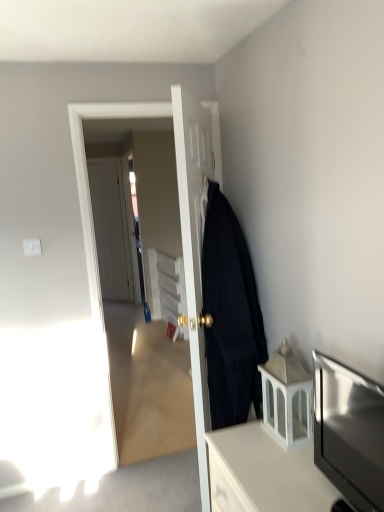
What is the approximate width of transparent glass door at center?

transparent glass door at center is 4.83 inches in width.

How much space does white glass lantern at lower right, the 1th cabinetry when ordered from top to bottom, occupy horizontally?

The width of white glass lantern at lower right, the 1th cabinetry when ordered from top to bottom, is 6.90 inches.

Describe the element at coordinates (287, 398) in the screenshot. I see `white glass lantern at lower right, the 1th cabinetry when ordered from top to bottom` at that location.

Find the location of a particular element. This screenshot has width=384, height=512. matte black tv at lower right is located at coordinates (349, 431).

Considering the sizes of objects white glossy cabinet at lower right, marked as the second cabinetry in a top-to-bottom arrangement, and matte black tv at lower right in the image provided, who is bigger, white glossy cabinet at lower right, marked as the second cabinetry in a top-to-bottom arrangement, or matte black tv at lower right?

white glossy cabinet at lower right, marked as the second cabinetry in a top-to-bottom arrangement.

From a real-world perspective, which is physically above, white glossy cabinet at lower right, which is the first cabinetry in bottom-to-top order, or matte black tv at lower right?

In real-world perspective, matte black tv at lower right is above.

Is white glossy cabinet at lower right, marked as the second cabinetry in a top-to-bottom arrangement, spatially inside matte black tv at lower right, or outside of it?

white glossy cabinet at lower right, marked as the second cabinetry in a top-to-bottom arrangement, is not inside matte black tv at lower right, it's outside.

Is white glass lantern at lower right, the 1th cabinetry when ordered from top to bottom, surrounding black woolen coat at right?

Actually, black woolen coat at right is outside white glass lantern at lower right, the 1th cabinetry when ordered from top to bottom.

From the image's perspective, starting from the black woolen coat at right, which cabinetry is the 1st one below? Please provide its 2D coordinates.

[(287, 398)]

Are white glass lantern at lower right, which is the second cabinetry from bottom to top, and black woolen coat at right far apart?

white glass lantern at lower right, which is the second cabinetry from bottom to top, is near black woolen coat at right, not far away.

Which is closer to the camera, (293,439) or (222,381)?

Point (293,439).

Between black woolen coat at right and white matte door at center, which is counted as the first door, starting from the left, which one has smaller width?

Thinner between the two is white matte door at center, which is counted as the first door, starting from the left.

Which object is further away from the camera, black woolen coat at right or white matte door at center, positioned as the first door in back-to-front order?

white matte door at center, positioned as the first door in back-to-front order, is more distant.

From the image's perspective, is black woolen coat at right beneath white matte door at center, the 2th door positioned from the right?

Correct, black woolen coat at right appears lower than white matte door at center, the 2th door positioned from the right, in the image.

From the image's perspective, which is above, matte black tv at lower right or white glass lantern at lower right, which is the second cabinetry from bottom to top?

white glass lantern at lower right, which is the second cabinetry from bottom to top, is shown above in the image.

Looking at their sizes, would you say matte black tv at lower right is wider or thinner than white glass lantern at lower right, which is the second cabinetry from bottom to top?

matte black tv at lower right is wider than white glass lantern at lower right, which is the second cabinetry from bottom to top.

This screenshot has height=512, width=384. Identify the location of cabinetry that is the 2nd one when counting backward from the matte black tv at lower right. (287, 398).

Based on the photo, measure the distance from black woolen coat at right to white glass lantern at lower right, which is the second cabinetry from bottom to top.

They are 11.84 inches apart.

Can you confirm if black woolen coat at right is positioned to the right of white glass lantern at lower right, the 1th cabinetry when ordered from top to bottom?

In fact, black woolen coat at right is to the left of white glass lantern at lower right, the 1th cabinetry when ordered from top to bottom.

Which is in front, black woolen coat at right or white glass lantern at lower right, the 1th cabinetry when ordered from top to bottom?

white glass lantern at lower right, the 1th cabinetry when ordered from top to bottom, is in front.

In the scene shown: Is black woolen coat at right positioned with its back to white glass lantern at lower right, which is the second cabinetry from bottom to top?

No, black woolen coat at right's orientation is not away from white glass lantern at lower right, which is the second cabinetry from bottom to top.

Is white glass lantern at lower right, the 1th cabinetry when ordered from top to bottom, aimed at white matte door at center, which is the 2th door in front-to-back order?

No, white glass lantern at lower right, the 1th cabinetry when ordered from top to bottom, is not facing towards white matte door at center, which is the 2th door in front-to-back order.

Is white glass lantern at lower right, the 1th cabinetry when ordered from top to bottom, far from white matte door at center, the 2th door positioned from the right?

Absolutely, white glass lantern at lower right, the 1th cabinetry when ordered from top to bottom, is distant from white matte door at center, the 2th door positioned from the right.

Who is taller, white glass lantern at lower right, which is the second cabinetry from bottom to top, or white matte door at center, which is counted as the first door, starting from the left?

Standing taller between the two is white matte door at center, which is counted as the first door, starting from the left.

In terms of width, does white glossy cabinet at lower right, marked as the second cabinetry in a top-to-bottom arrangement, look wider or thinner when compared to transparent glass door at center?

white glossy cabinet at lower right, marked as the second cabinetry in a top-to-bottom arrangement, is wider than transparent glass door at center.

Which object is positioned more to the left, white glossy cabinet at lower right, marked as the second cabinetry in a top-to-bottom arrangement, or transparent glass door at center?

Positioned to the left is transparent glass door at center.

Is point (284, 485) farther from viewer compared to point (104, 408)?

No, it is in front of (104, 408).

Which object is closer to the camera, white glossy cabinet at lower right, which is the first cabinetry in bottom-to-top order, or transparent glass door at center?

white glossy cabinet at lower right, which is the first cabinetry in bottom-to-top order, is more forward.

Locate an element on the screen. Image resolution: width=384 pixels, height=512 pixels. cabinetry below the matte black tv at lower right (from the image's perspective) is located at coordinates (264, 474).

Locate an element on the screen. The width and height of the screenshot is (384, 512). cloak above the white glass lantern at lower right, which is the second cabinetry from bottom to top (from a real-world perspective) is located at coordinates (230, 316).

When comparing their distances from white glass lantern at lower right, which is the second cabinetry from bottom to top, does white matte door at center, which is the 2th door in front-to-back order, or matte black coat at center, positioned as the first door in front-to-back order, seem closer?

Among the two, matte black coat at center, positioned as the first door in front-to-back order, is located nearer to white glass lantern at lower right, which is the second cabinetry from bottom to top.

In the scene shown: Which object lies nearer to the anchor point white matte door at center, which is the 2th door in front-to-back order, white glass lantern at lower right, which is the second cabinetry from bottom to top, or black woolen coat at right?

black woolen coat at right is closer to white matte door at center, which is the 2th door in front-to-back order.

Looking at the image, which one is located further to white glossy cabinet at lower right, marked as the second cabinetry in a top-to-bottom arrangement, white matte door at center, the 2th door positioned from the right, or matte black tv at lower right?

Based on the image, white matte door at center, the 2th door positioned from the right, appears to be further to white glossy cabinet at lower right, marked as the second cabinetry in a top-to-bottom arrangement.

Based on their spatial positions, is black woolen coat at right or matte black tv at lower right closer to white glass lantern at lower right, the 1th cabinetry when ordered from top to bottom?

matte black tv at lower right is positioned closer to the anchor white glass lantern at lower right, the 1th cabinetry when ordered from top to bottom.

When comparing their distances from white glossy cabinet at lower right, which is the first cabinetry in bottom-to-top order, does black woolen coat at right or transparent glass door at center seem closer?

black woolen coat at right.

From the image, which object appears to be nearer to white glossy cabinet at lower right, which is the first cabinetry in bottom-to-top order, white glass lantern at lower right, the 1th cabinetry when ordered from top to bottom, or matte black coat at center, acting as the 1th door starting from the right?

white glass lantern at lower right, the 1th cabinetry when ordered from top to bottom, is closer to white glossy cabinet at lower right, which is the first cabinetry in bottom-to-top order.

Which object lies further to the anchor point matte black coat at center, which appears as the 2th door when viewed from the left, transparent glass door at center or white glossy cabinet at lower right, which is the first cabinetry in bottom-to-top order?

white glossy cabinet at lower right, which is the first cabinetry in bottom-to-top order, is further to matte black coat at center, which appears as the 2th door when viewed from the left.

Looking at the image, which one is located further to black woolen coat at right, matte black tv at lower right or white glass lantern at lower right, which is the second cabinetry from bottom to top?

Based on the image, matte black tv at lower right appears to be further to black woolen coat at right.

This screenshot has height=512, width=384. I want to click on cabinetry between white glossy cabinet at lower right, which is the first cabinetry in bottom-to-top order, and transparent glass door at center from front to back, so click(287, 398).

Image resolution: width=384 pixels, height=512 pixels. Identify the location of cloak between transparent glass door at center and white glass lantern at lower right, which is the second cabinetry from bottom to top, in the horizontal direction. (230, 316).

Where is `door between transparent glass door at center and white glossy cabinet at lower right, which is the first cabinetry in bottom-to-top order, from top to bottom`? The image size is (384, 512). door between transparent glass door at center and white glossy cabinet at lower right, which is the first cabinetry in bottom-to-top order, from top to bottom is located at coordinates (194, 250).

In order to click on cabinetry positioned between matte black tv at lower right and white glass lantern at lower right, the 1th cabinetry when ordered from top to bottom, from near to far in this screenshot , I will do `click(264, 474)`.